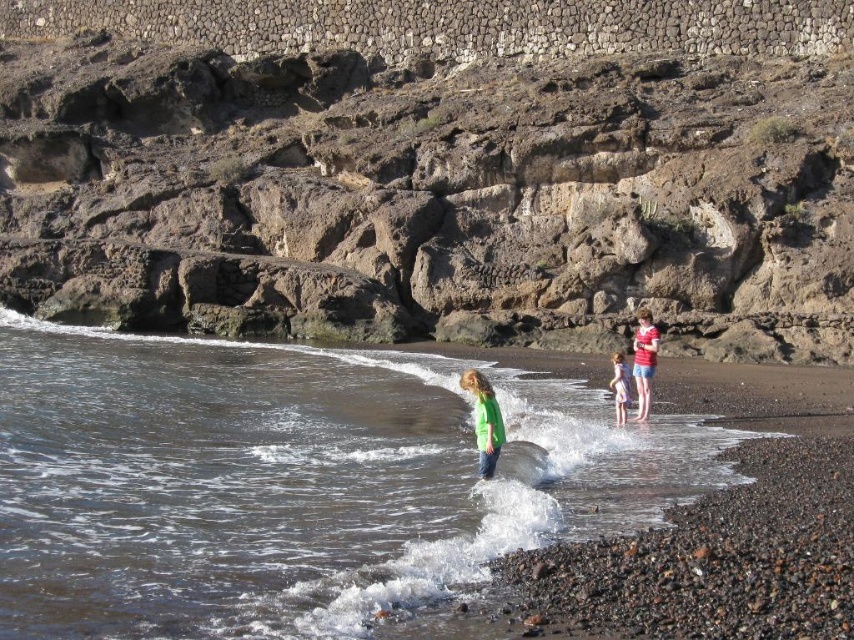
You are standing on the beach and see the clear water at center and the green matte shirt at center. Which one is closer to you?

The green matte shirt at center is closer to you because it is below the clear water at center, meaning it is positioned lower in the scene.

You are a photographer trying to capture a shot of the green matte shirt at center and the brown rocky cliff at upper center. Based on their positions, which object is located to the left of the other?

The brown rocky cliff at upper center is positioned on the left side of green matte shirt at center, so the cliff is to the left of the shirt.

You are standing on the beach and want to walk from the green matte shirt at center to the clear water at center. Is there enough space between them for you to walk comfortably?

The clear water at center might be wider than green matte shirt at center, so there is likely enough space to walk comfortably between them.